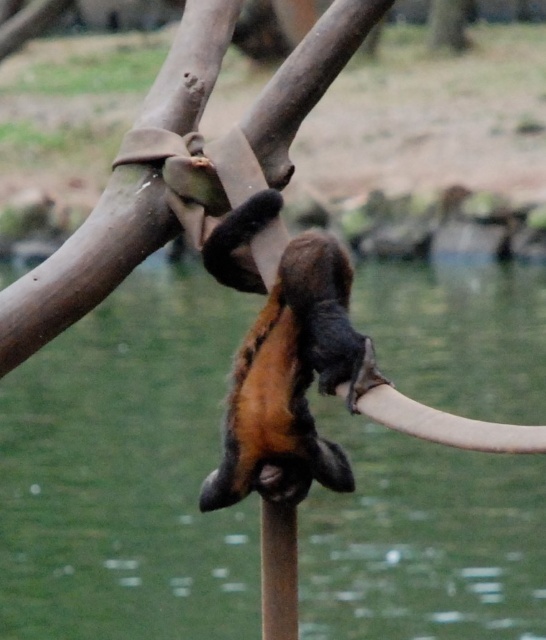
Question: Which point is closer to the camera?

Choices:
 (A) brown furry monkey at center
 (B) smooth bark tree at upper center
 (C) brown leather water at center

Answer: (A)

Question: Is brown leather water at center to the right of brown furry monkey at center from the viewer's perspective?

Choices:
 (A) no
 (B) yes

Answer: (A)

Question: Which point is closer to the camera?

Choices:
 (A) brown furry monkey at center
 (B) smooth bark tree at upper center
 (C) brown leather water at center

Answer: (A)

Question: Is brown furry monkey at center smaller than smooth bark tree at upper center?

Choices:
 (A) no
 (B) yes

Answer: (B)

Question: Does brown leather water at center have a greater width compared to smooth bark tree at upper center?

Choices:
 (A) no
 (B) yes

Answer: (A)

Question: Which point appears farthest from the camera in this image?

Choices:
 (A) (436, 12)
 (B) (495, 314)
 (C) (337, 257)

Answer: (A)